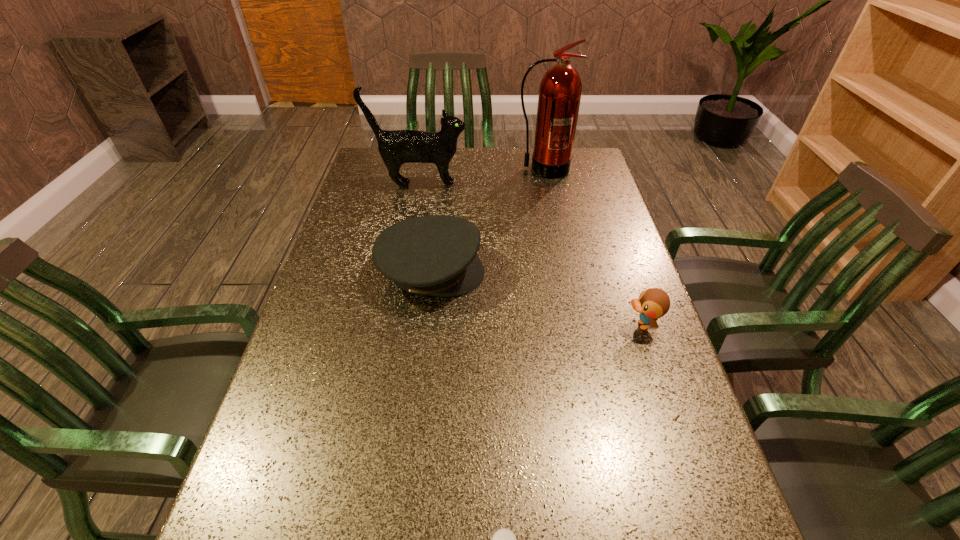
At what (x,y) coordinates should I click in order to perform the action: click on the third closest object to the third nearest object. Please return your answer as a coordinate pair (x, y). This screenshot has width=960, height=540. Looking at the image, I should click on (560, 89).

Identify the location of free space that satisfies the following two spatial constraints: 1. on the front-facing side of the fourth object from left to right; 2. on the face of the fourth shortest object. This screenshot has height=540, width=960. (546, 185).